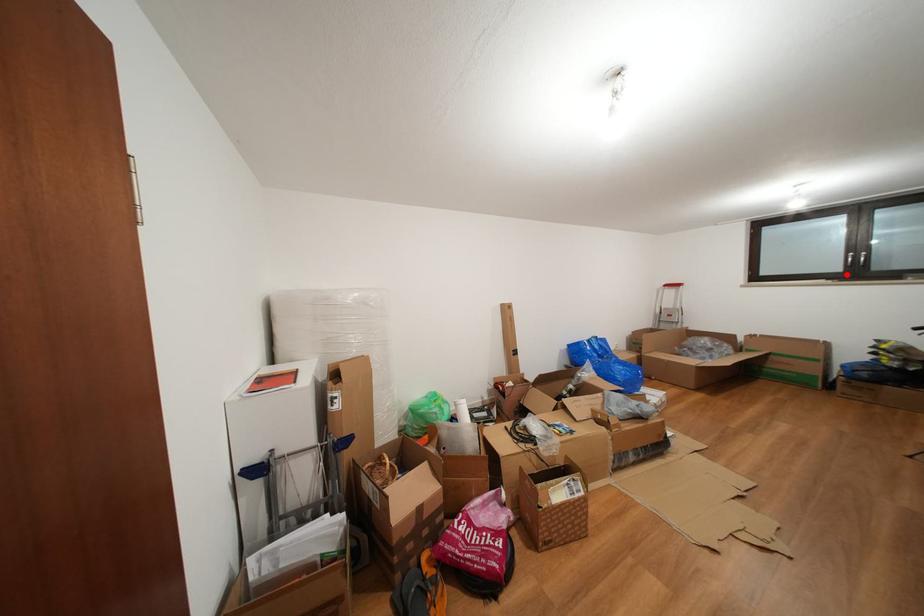
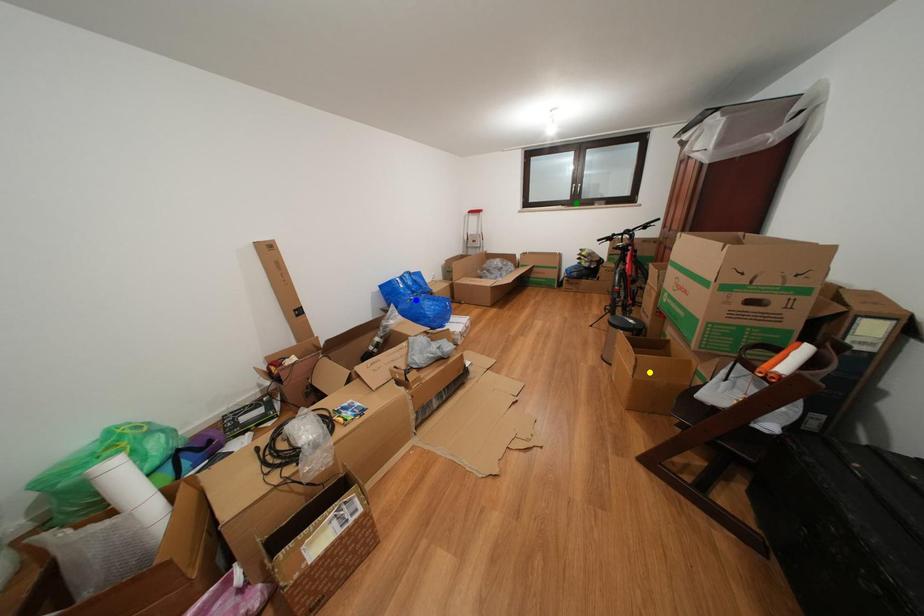
Question: I am providing you with two images of the same scene from different viewpoints. A red point is marked on the first image. You are given multiple points on the second image. Which mark in image 2 goes with the point in image 1?

Choices:
 (A) yellow point
 (B) green point
 (C) blue point

Answer: (B)